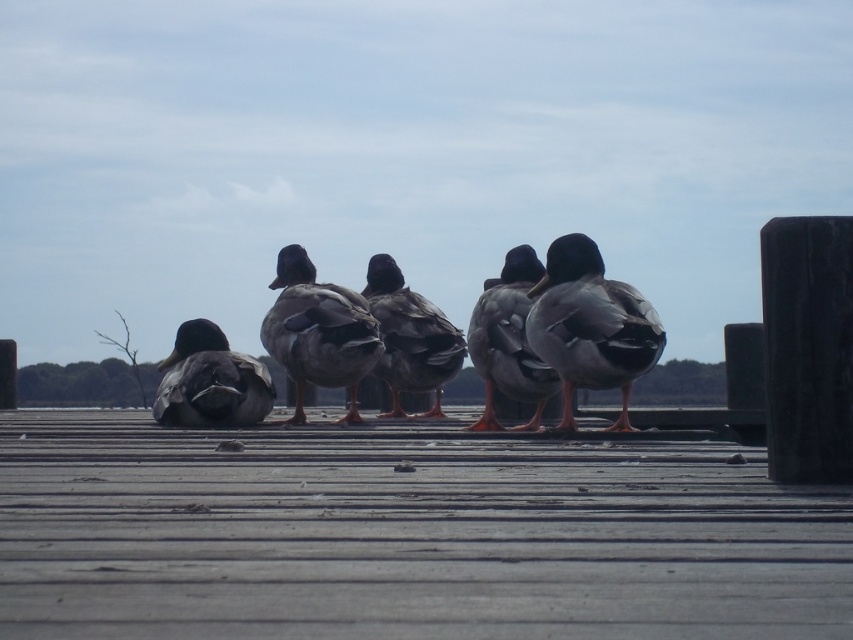
Question: Does brown feathered duck at center have a smaller size compared to dark brown feathers at center?

Choices:
 (A) no
 (B) yes

Answer: (B)

Question: Among these objects, which one is farthest from the camera?

Choices:
 (A) wooden planks at center
 (B) gray matte duck at center
 (C) dark gray feathers at center

Answer: (B)

Question: Which is farther from the gray matte duck at center?

Choices:
 (A) brown feathered duck at center
 (B) dark gray feathers at center

Answer: (A)

Question: Which point appears farthest from the camera in this image?

Choices:
 (A) (532, 500)
 (B) (549, 291)

Answer: (B)

Question: Is wooden planks at center to the left of gray matte duck at center from the viewer's perspective?

Choices:
 (A) no
 (B) yes

Answer: (B)

Question: Is wooden planks at center bigger than dark gray matte duck at left?

Choices:
 (A) no
 (B) yes

Answer: (A)